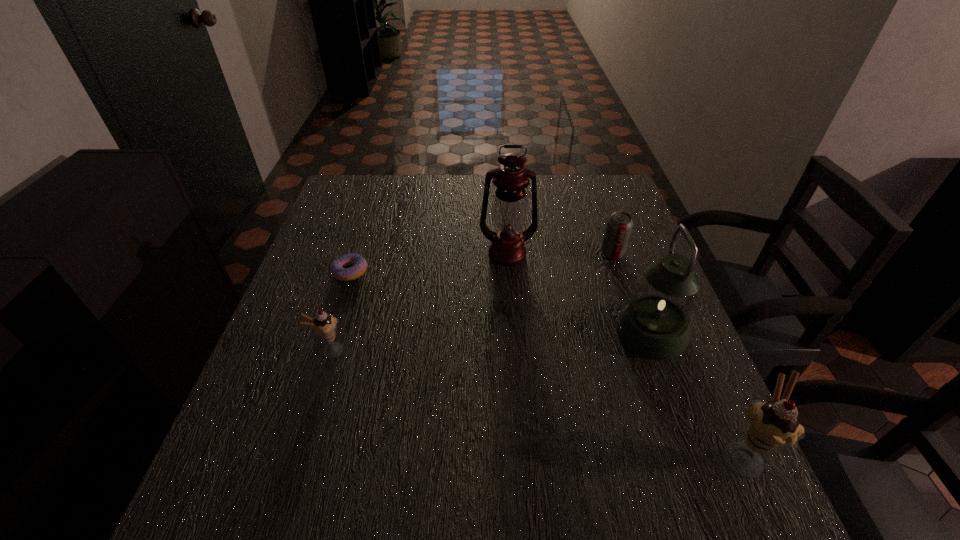
Where is `vacant region that satisfies the following two spatial constraints: 1. on the front side of the lantern; 2. on the left side of the soda can`? This screenshot has height=540, width=960. vacant region that satisfies the following two spatial constraints: 1. on the front side of the lantern; 2. on the left side of the soda can is located at coordinates (639, 332).